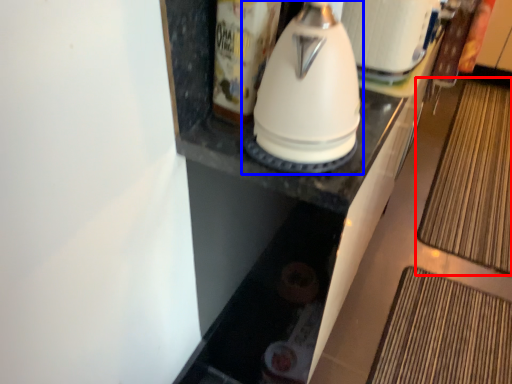
Question: Which object appears farthest to the camera in this image, mat (highlighted by a red box) or kitchen appliance (highlighted by a blue box)?

Choices:
 (A) mat
 (B) kitchen appliance

Answer: (A)